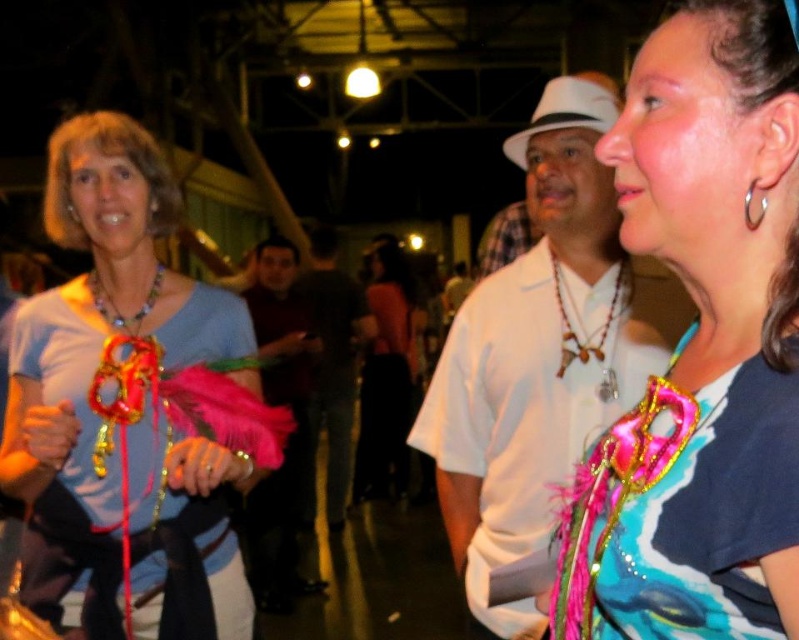
Question: Which object is the closest to the shiny pink feather boa at center?

Choices:
 (A) white matte shirt at center
 (B) multicolored beaded necklace at upper left
 (C) dark brown leather jacket at center
 (D) black satin dress at center

Answer: (A)

Question: Can you confirm if maroon fabric shirt at center is positioned above dark brown leather jacket at center?

Choices:
 (A) no
 (B) yes

Answer: (A)

Question: Is black satin dress at center below brown beaded necklace at center?

Choices:
 (A) no
 (B) yes

Answer: (B)

Question: Estimate the real-world distances between objects in this image. Which object is farther from the shiny pink feather boa at center?

Choices:
 (A) white matte shirt at center
 (B) matte blue shirt at left
 (C) brown beaded necklace at center

Answer: (C)

Question: Does dark brown leather jacket at center have a greater width compared to multicolored beaded necklace at upper left?

Choices:
 (A) yes
 (B) no

Answer: (A)

Question: Among these objects, which one is nearest to the camera?

Choices:
 (A) dark brown leather jacket at center
 (B) brown beaded necklace at center
 (C) multicolored beaded necklace at upper left

Answer: (C)